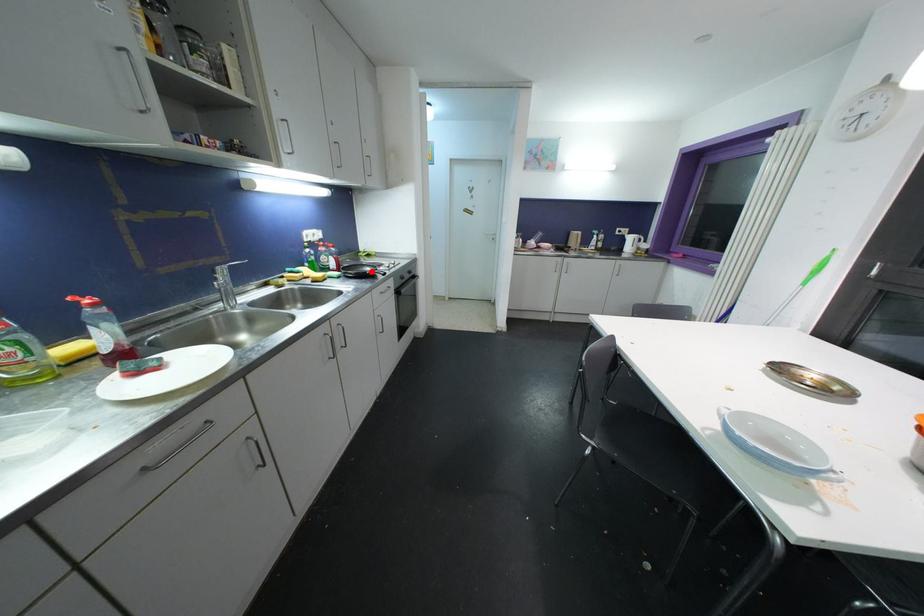
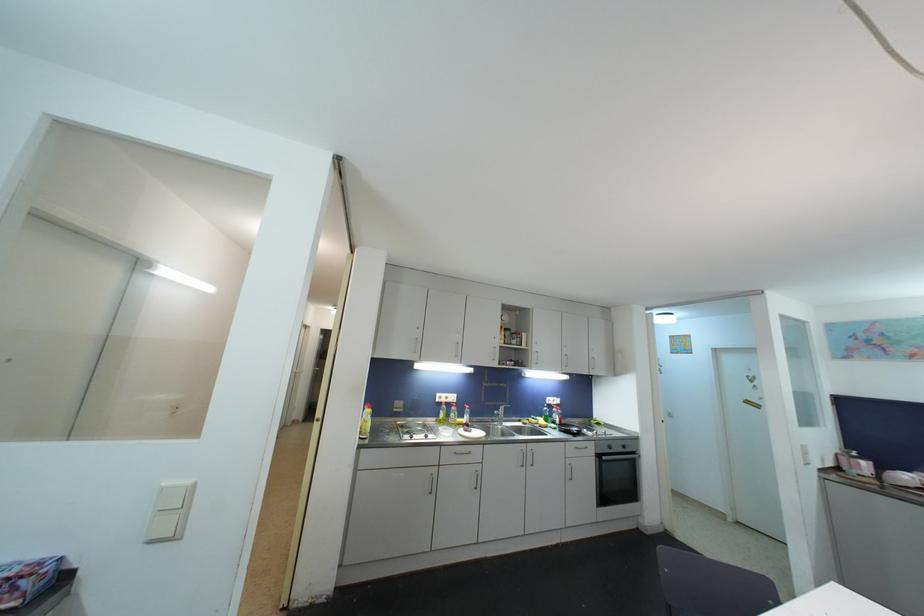
Question: I am providing you with two images of the same scene from different viewpoints. Image1 has a red point marked. In image2, the corresponding 3D location appears at what relative position? Reply with the corresponding letter.

Choices:
 (A) Closer
 (B) Farther

Answer: (B)